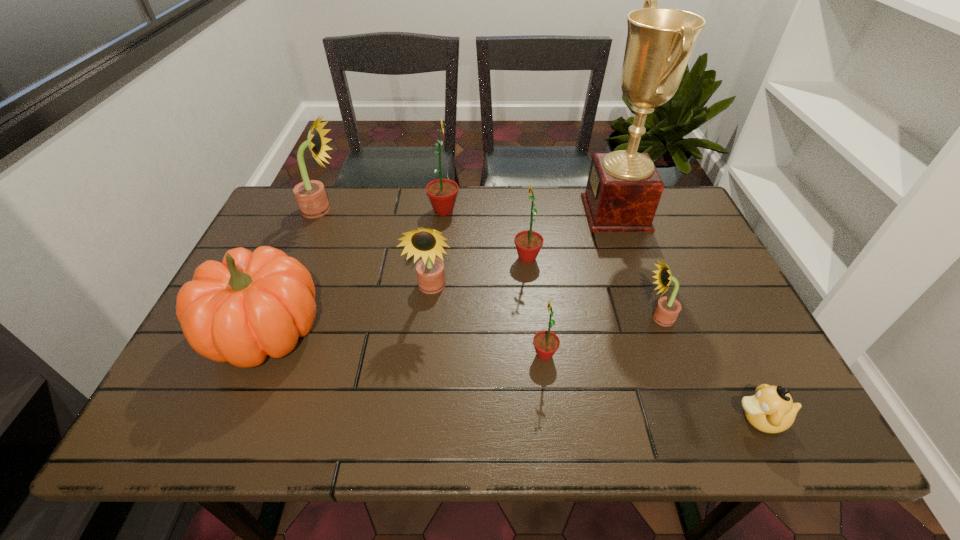
Find the location of a particular element. vacant space that's between the pumpkin and the second yellow sunflower from left to right is located at coordinates (348, 310).

Find the location of a particular element. The width and height of the screenshot is (960, 540). vacant space that's between the second yellow sunflower from right to left and the sixth nearest object is located at coordinates (479, 273).

At what (x,y) coordinates should I click in order to perform the action: click on vacant area that lies between the second farthest green sunflower and the smallest yellow sunflower. Please return your answer as a coordinate pair (x, y). Looking at the image, I should click on (593, 288).

Image resolution: width=960 pixels, height=540 pixels. I want to click on free space that is in between the nearest yellow sunflower and the smallest green sunflower, so click(602, 336).

Find the location of a particular element. The image size is (960, 540). vacant area that lies between the nearest yellow sunflower and the second nearest yellow sunflower is located at coordinates point(545,303).

What are the coordinates of `vacant region between the orange pumpkin and the rightmost yellow sunflower` in the screenshot? It's located at (462, 325).

Locate an element on the screen. Image resolution: width=960 pixels, height=540 pixels. free space between the biggest yellow sunflower and the leftmost green sunflower is located at coordinates (383, 210).

Find the location of a particular element. vacant region between the pumpkin and the fourth farthest sunflower is located at coordinates (348, 310).

You are a GUI agent. You are given a task and a screenshot of the screen. Output one action in this format:
    pyautogui.click(x=<x>, y=<y>)
    Task: Click on the object that stands as the third closest to the leftmost sunflower
    The width and height of the screenshot is (960, 540).
    Given the screenshot: What is the action you would take?
    pyautogui.click(x=427, y=243)

Select which object appears as the seventh closest to the second yellow sunflower from left to right. Please provide its 2D coordinates. Your answer should be formatted as a tuple, i.e. [(x, y)], where the tuple contains the x and y coordinates of a point satisfying the conditions above.

[(667, 309)]